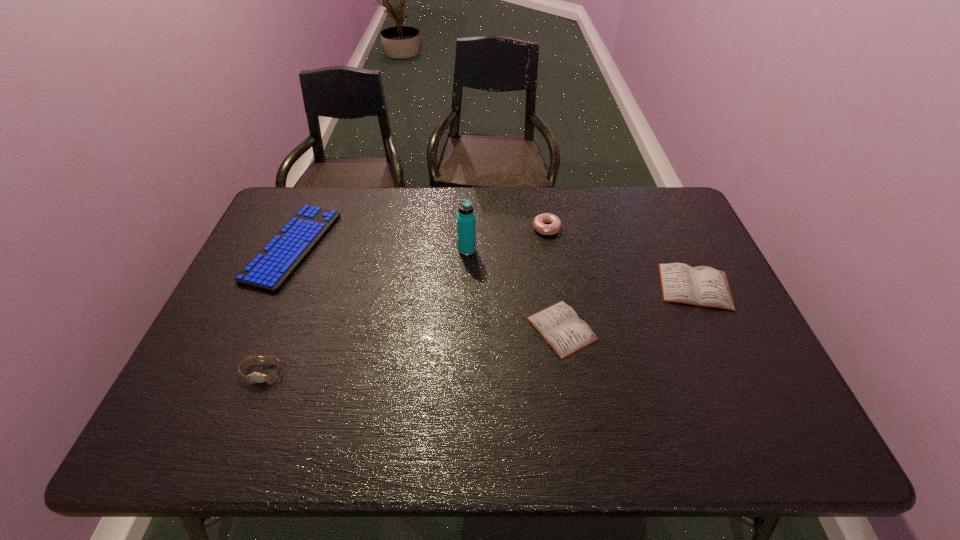
You are a GUI agent. You are given a task and a screenshot of the screen. Output one action in this format:
    pyautogui.click(x=<x>, y=<y>)
    Task: Click on the left diary
    
    Given the screenshot: What is the action you would take?
    pyautogui.click(x=559, y=325)

This screenshot has height=540, width=960. I want to click on the shortest object, so click(x=559, y=325).

Identify the location of the fifth tallest object. (703, 286).

Find the location of `the taller diary`. the taller diary is located at coordinates (703, 286).

What are the coordinates of `computer keyboard` in the screenshot? It's located at (273, 266).

Identify the location of water bottle. (466, 220).

You are a GUI agent. You are given a task and a screenshot of the screen. Output one action in this format:
    pyautogui.click(x=<x>, y=<y>)
    Task: Click on the fourth object from right to left
    The width and height of the screenshot is (960, 540).
    Given the screenshot: What is the action you would take?
    pyautogui.click(x=466, y=220)

Where is `doughnut`? doughnut is located at coordinates (553, 227).

Locate an element on the screen. The width and height of the screenshot is (960, 540). watch is located at coordinates (256, 377).

Locate an element on the screen. Image resolution: width=960 pixels, height=540 pixels. vacant space positioned on the left of the left diary is located at coordinates (442, 329).